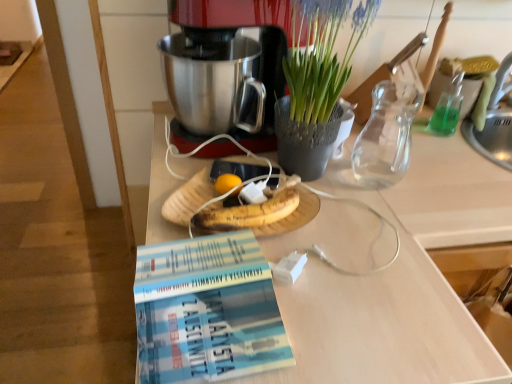
Describe the element at coordinates (397, 285) in the screenshot. I see `white matte desk at center` at that location.

I want to click on transparent glass vase at upper right, so click(386, 135).

In order to click on green textured vase at upper center in this screenshot , I will do coord(316,83).

Describe the element at coordinates (316, 83) in the screenshot. The width and height of the screenshot is (512, 384). I see `green textured vase at upper center` at that location.

At what (x,y) coordinates should I click in order to perform the action: click on blue paperback book at lower center. Please return your answer as a coordinate pair (x, y). Image resolution: width=512 pixels, height=384 pixels. Looking at the image, I should click on (207, 311).

The image size is (512, 384). I want to click on desk located on the right of blue paperback book at lower center, so click(x=397, y=285).

From a real-world perspective, is white matte desk at center below blue paperback book at lower center?

Correct, in the physical world, white matte desk at center is lower than blue paperback book at lower center.

Can you confirm if white matte desk at center is shorter than blue paperback book at lower center?

No.

Could you tell me if green textured vase at upper center is facing blue paperback book at lower center?

No, green textured vase at upper center is not oriented towards blue paperback book at lower center.

Is green textured vase at upper center wider than blue paperback book at lower center?

No.

Is point (294, 165) closer or farther from the camera than point (269, 363)?

Point (294, 165).

Is green textured vase at upper center surrounding blue paperback book at lower center?

That's incorrect, blue paperback book at lower center is not inside green textured vase at upper center.

Can you tell me how much metallic silver coffee maker at center and blue paperback book at lower center differ in facing direction?

The facing directions of metallic silver coffee maker at center and blue paperback book at lower center are 75.3 degrees apart.

Considering the positions of objects metallic silver coffee maker at center and blue paperback book at lower center in the image provided, who is more to the left, metallic silver coffee maker at center or blue paperback book at lower center?

Positioned to the left is blue paperback book at lower center.

Looking at the image, does metallic silver coffee maker at center seem bigger or smaller compared to blue paperback book at lower center?

In the image, metallic silver coffee maker at center appears to be larger than blue paperback book at lower center.

Is metallic silver coffee maker at center in contact with blue paperback book at lower center?

No, metallic silver coffee maker at center is not with blue paperback book at lower center.

Considering the relative sizes of transparent glass vase at upper right and green textured vase at upper center in the image provided, is transparent glass vase at upper right taller than green textured vase at upper center?

Incorrect, the height of transparent glass vase at upper right is not larger of that of green textured vase at upper center.

What's the angular difference between transparent glass vase at upper right and green textured vase at upper center's facing directions?

1.85 degrees separate the facing orientations of transparent glass vase at upper right and green textured vase at upper center.

From the image's perspective, is transparent glass vase at upper right located beneath green textured vase at upper center?

Indeed, from the image's perspective, transparent glass vase at upper right is shown beneath green textured vase at upper center.

Relative to green textured vase at upper center, is transparent glass vase at upper right in front or behind?

Clearly, transparent glass vase at upper right is behind green textured vase at upper center.

Where is `tea pot that appears above the white matte desk at center (from a real-world perspective)`? tea pot that appears above the white matte desk at center (from a real-world perspective) is located at coordinates (386, 135).

Is transparent glass vase at upper right not close to white matte desk at center?

transparent glass vase at upper right is actually quite close to white matte desk at center.

Between point (408, 126) and point (439, 193), which one is positioned in front?

The point (439, 193) is more forward.

Measure the distance between transparent glass vase at upper right and white matte desk at center.

A distance of 6.60 inches exists between transparent glass vase at upper right and white matte desk at center.

Is metallic silver coffee maker at center at the back of transparent glass vase at upper right?

That's not correct — transparent glass vase at upper right is not looking away from metallic silver coffee maker at center.

What's the angular difference between transparent glass vase at upper right and metallic silver coffee maker at center's facing directions?

The angle between the facing direction of transparent glass vase at upper right and the facing direction of metallic silver coffee maker at center is 72.5 degrees.

Based on the photo, from a real-world perspective, is transparent glass vase at upper right physically located above or below metallic silver coffee maker at center?

transparent glass vase at upper right is below metallic silver coffee maker at center.

Can you confirm if transparent glass vase at upper right is taller than metallic silver coffee maker at center?

No, transparent glass vase at upper right is not taller than metallic silver coffee maker at center.

How far apart are metallic silver coffee maker at center and green textured vase at upper center?

metallic silver coffee maker at center and green textured vase at upper center are 4.36 inches apart.

Is metallic silver coffee maker at center taller than green textured vase at upper center?

In fact, metallic silver coffee maker at center may be shorter than green textured vase at upper center.

Can we say metallic silver coffee maker at center lies outside green textured vase at upper center?

Indeed, metallic silver coffee maker at center is completely outside green textured vase at upper center.

Who is bigger, metallic silver coffee maker at center or green textured vase at upper center?

metallic silver coffee maker at center is bigger.

Locate an element on the screen. The height and width of the screenshot is (384, 512). desk on the right of the blue paperback book at lower center is located at coordinates (397, 285).

The image size is (512, 384). Find the location of `book in front of the green textured vase at upper center`. book in front of the green textured vase at upper center is located at coordinates (207, 311).

Which object lies further to the anchor point white matte desk at center, blue paperback book at lower center or transparent glass vase at upper right?

Among the two, blue paperback book at lower center is located further to white matte desk at center.

Which object lies nearer to the anchor point blue paperback book at lower center, green textured vase at upper center or transparent glass vase at upper right?

green textured vase at upper center lies closer to blue paperback book at lower center than the other object.

Considering their positions, is blue paperback book at lower center positioned closer to green textured vase at upper center than metallic silver coffee maker at center?

The object closer to green textured vase at upper center is metallic silver coffee maker at center.

When comparing their distances from white matte desk at center, does metallic silver coffee maker at center or transparent glass vase at upper right seem closer?

transparent glass vase at upper right lies closer to white matte desk at center than the other object.

Which object lies further to the anchor point metallic silver coffee maker at center, green textured vase at upper center or transparent glass vase at upper right?

transparent glass vase at upper right.

Based on their spatial positions, is transparent glass vase at upper right or green textured vase at upper center further from metallic silver coffee maker at center?

transparent glass vase at upper right is positioned further to the anchor metallic silver coffee maker at center.

From the image, which object appears to be farther from blue paperback book at lower center, transparent glass vase at upper right or metallic silver coffee maker at center?

Among the two, transparent glass vase at upper right is located further to blue paperback book at lower center.

Estimate the real-world distances between objects in this image. Which object is closer to metallic silver coffee maker at center, transparent glass vase at upper right or white matte desk at center?

Based on the image, white matte desk at center appears to be nearer to metallic silver coffee maker at center.

Where is `houseplant situated between metallic silver coffee maker at center and transparent glass vase at upper right from left to right`? Image resolution: width=512 pixels, height=384 pixels. houseplant situated between metallic silver coffee maker at center and transparent glass vase at upper right from left to right is located at coordinates (316, 83).

The width and height of the screenshot is (512, 384). I want to click on tea pot that lies between green textured vase at upper center and white matte desk at center from top to bottom, so click(386, 135).

In order to click on book between green textured vase at upper center and white matte desk at center in the vertical direction in this screenshot , I will do `click(207, 311)`.

This screenshot has height=384, width=512. Find the location of `book between transparent glass vase at upper right and white matte desk at center vertically`. book between transparent glass vase at upper right and white matte desk at center vertically is located at coordinates (207, 311).